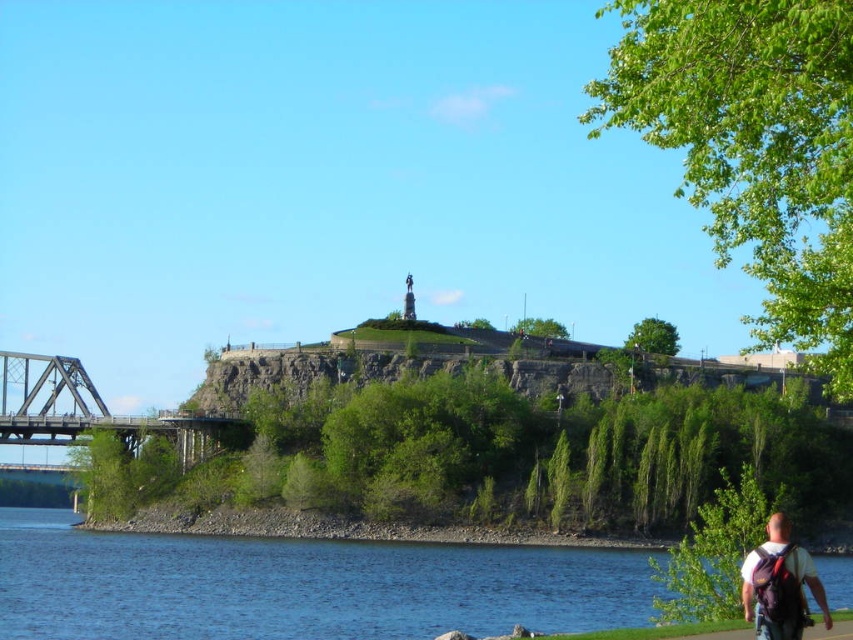
Which is above, metallic gray bridge at left or white matte shirt at lower right?

Positioned higher is white matte shirt at lower right.

Which is more to the right, metallic gray bridge at left or white matte shirt at lower right?

white matte shirt at lower right

Describe the element at coordinates (86, 410) in the screenshot. I see `metallic gray bridge at left` at that location.

Where is `metallic gray bridge at left`? metallic gray bridge at left is located at coordinates (86, 410).

Does point (323, 602) lie behind point (74, 404)?

No, (323, 602) is closer to viewer.

This screenshot has width=853, height=640. What are the coordinates of `blue water at lower left` in the screenshot? It's located at (299, 586).

This screenshot has height=640, width=853. I want to click on blue water at lower left, so click(x=299, y=586).

Where is `blue water at lower left`? This screenshot has height=640, width=853. blue water at lower left is located at coordinates [x=299, y=586].

Is blue water at lower left taller than white matte shirt at lower right?

Correct, blue water at lower left is much taller as white matte shirt at lower right.

The height and width of the screenshot is (640, 853). Identify the location of blue water at lower left. pyautogui.click(x=299, y=586).